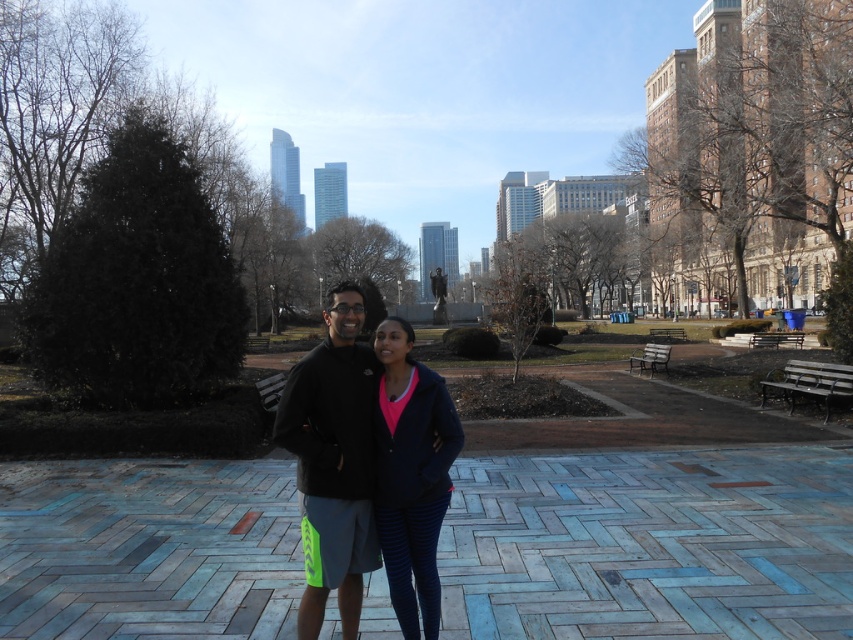
Question: Does dark blue fleece at center have a lesser width compared to matte blue leggings at center?

Choices:
 (A) yes
 (B) no

Answer: (B)

Question: Is dark blue fleece at center bigger than matte blue leggings at center?

Choices:
 (A) no
 (B) yes

Answer: (B)

Question: Considering the relative positions of dark blue fleece at center and matte blue leggings at center in the image provided, where is dark blue fleece at center located with respect to matte blue leggings at center?

Choices:
 (A) right
 (B) left

Answer: (B)

Question: Which point is closer to the camera?

Choices:
 (A) matte blue leggings at center
 (B) dark blue fleece at center

Answer: (B)